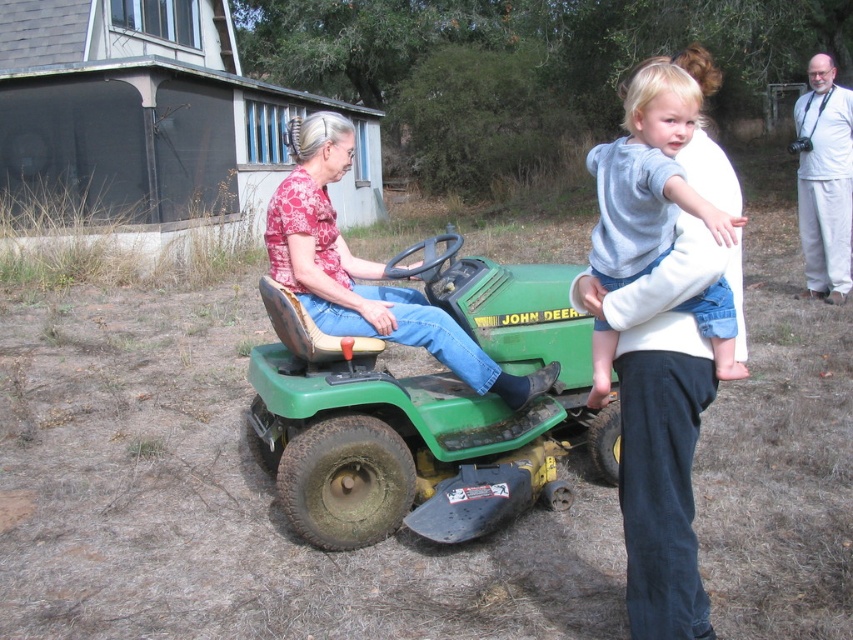
Question: Among these objects, which one is farthest from the camera?

Choices:
 (A) light gray fleece shirt at upper right
 (B) green rubber tractor at center

Answer: (B)

Question: Can you confirm if green rubber tractor at center is positioned below matte pink shirt at center?

Choices:
 (A) yes
 (B) no

Answer: (A)

Question: Which of the following is the closest to the observer?

Choices:
 (A) (291, 358)
 (B) (415, 298)

Answer: (A)

Question: Does green rubber tractor at center have a larger size compared to light gray fleece shirt at upper right?

Choices:
 (A) no
 (B) yes

Answer: (B)

Question: Among these objects, which one is nearest to the camera?

Choices:
 (A) matte pink shirt at center
 (B) green rubber tractor at center
 (C) light gray fleece shirt at upper right

Answer: (C)

Question: Is green rubber tractor at center further to the viewer compared to matte pink shirt at center?

Choices:
 (A) yes
 (B) no

Answer: (B)